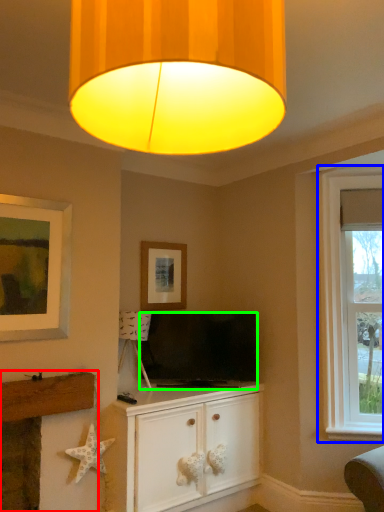
Question: Based on their relative distances, which object is farther from fireplace (highlighted by a red box)? Choose from window (highlighted by a blue box) and television (highlighted by a green box).

Choices:
 (A) window
 (B) television

Answer: (A)